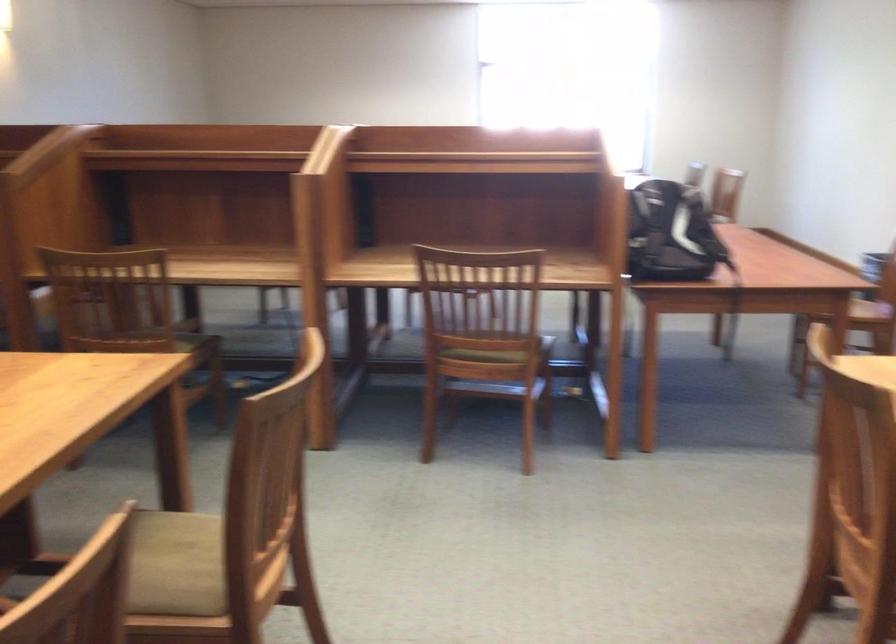
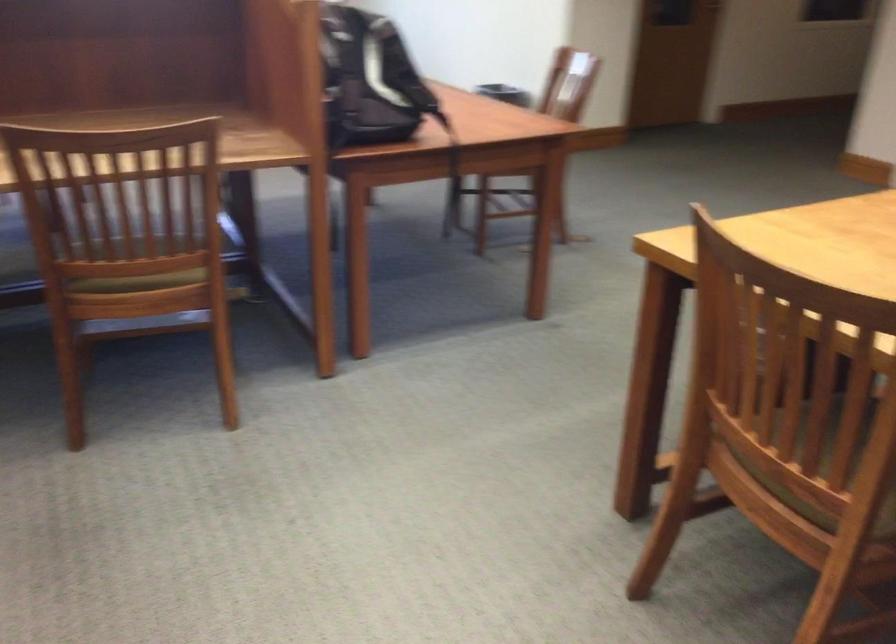
The point at (676, 223) is marked in the first image. Where is the corresponding point in the second image?

(371, 80)